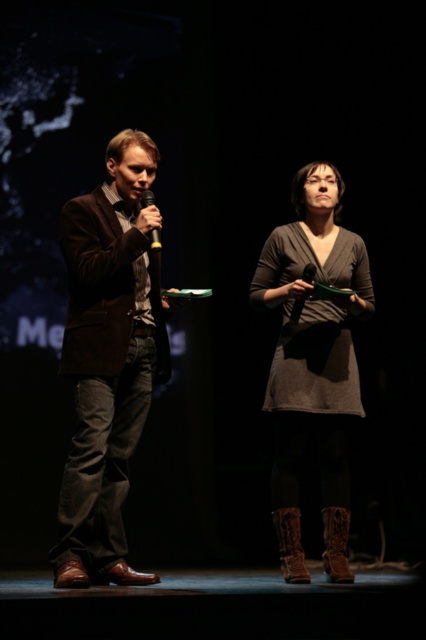
You are an event planner standing at the back of the stage. You need to place a decorative item between the two points indicated by point coordinates point [83,257] and point [314,428]. Which point should the item be closer to in order to appear centered from the audience perspective?

The decorative item should be placed closer to point [83,257] because it is closer to the viewer than point [314,428], so positioning it nearer to that point would create a visually centered appearance from the audience perspective.

You are standing on the stage and want to move from the point at coordinates point (x=333, y=524) to the point at coordinates point (x=158, y=246). Which direction should you move?

You should move forward because point (x=333, y=524) is behind point (x=158, y=246).